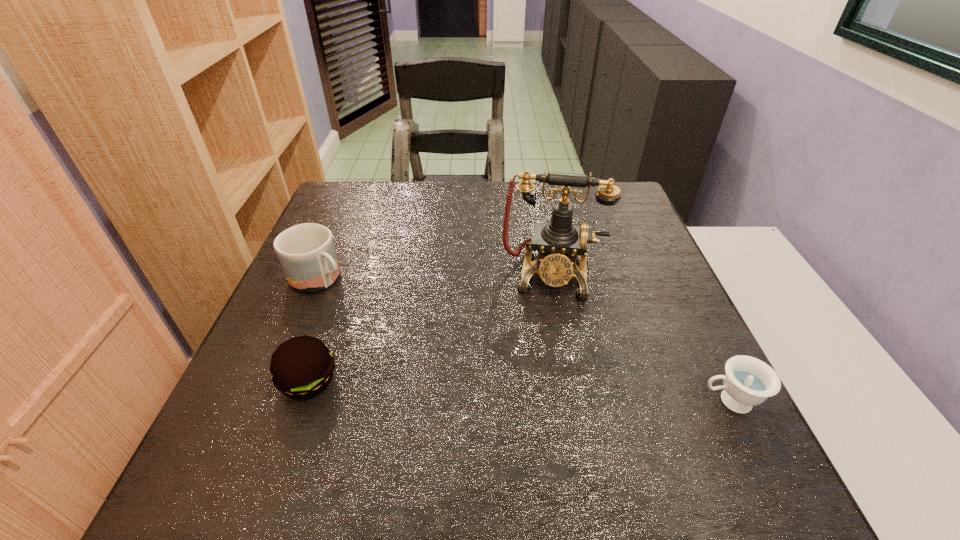
Find the location of a particular element. This screenshot has width=960, height=540. free space on the desktop that is between the patty and the rightmost object and is positioned on the front of the telephone, featuring the rotary dial is located at coordinates (543, 393).

Where is `vacant space on the desktop that is between the patty and the teacup and is positioned on the side with the handle of the third shortest object`? Image resolution: width=960 pixels, height=540 pixels. vacant space on the desktop that is between the patty and the teacup and is positioned on the side with the handle of the third shortest object is located at coordinates (487, 390).